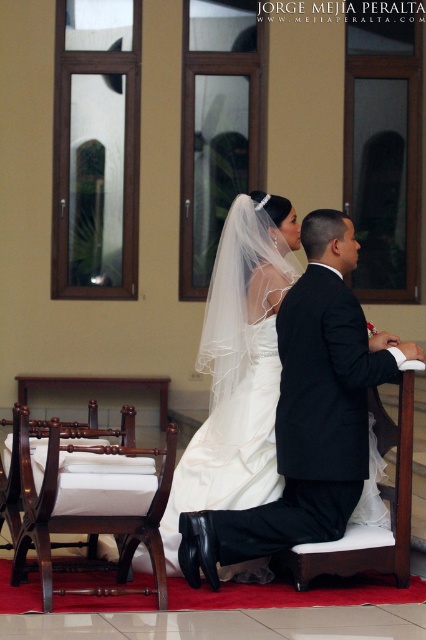
Can you confirm if white satin dress at center is positioned to the right of white fabric cushion at lower center?

In fact, white satin dress at center is to the left of white fabric cushion at lower center.

Does white satin dress at center have a lesser width compared to white fabric cushion at lower center?

Incorrect, white satin dress at center's width is not less than white fabric cushion at lower center's.

Between point (215, 268) and point (356, 570), which one is positioned behind?

The point (215, 268) is more distant.

Identify the location of white satin dress at center. The height and width of the screenshot is (640, 426). (238, 369).

Can you confirm if white satin dress at center is wider than mahogany wood chair at left?

No, white satin dress at center is not wider than mahogany wood chair at left.

Can you confirm if white satin dress at center is shorter than mahogany wood chair at left?

In fact, white satin dress at center may be taller than mahogany wood chair at left.

Between point (221, 252) and point (83, 438), which one is positioned in front?

Point (83, 438)

You are a GUI agent. You are given a task and a screenshot of the screen. Output one action in this format:
    pyautogui.click(x=<x>, y=<y>)
    Task: Click on the white satin dress at center
    The height and width of the screenshot is (640, 426).
    Given the screenshot: What is the action you would take?
    pyautogui.click(x=238, y=369)

Who is taller, mahogany wood chair at left or white fabric cushion at lower center?

With more height is white fabric cushion at lower center.

Between point (111, 564) and point (405, 474), which one is positioned behind?

The point (111, 564) is more distant.

Which is behind, point (95, 528) or point (304, 570)?

Positioned behind is point (304, 570).

You are a GUI agent. You are given a task and a screenshot of the screen. Output one action in this format:
    pyautogui.click(x=<x>, y=<y>)
    Task: Click on the mahogany wood chair at left
    The image size is (426, 640).
    Given the screenshot: What is the action you would take?
    pyautogui.click(x=89, y=506)